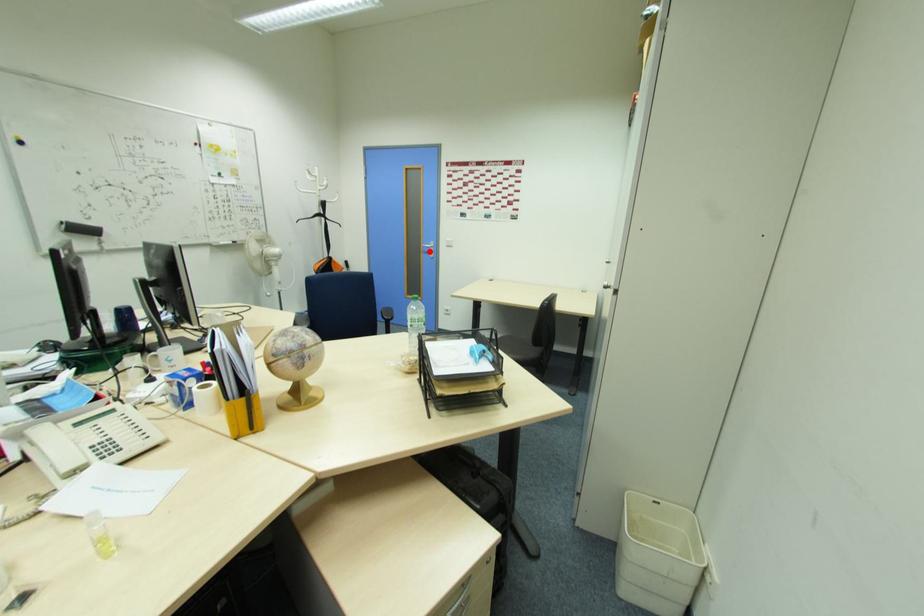
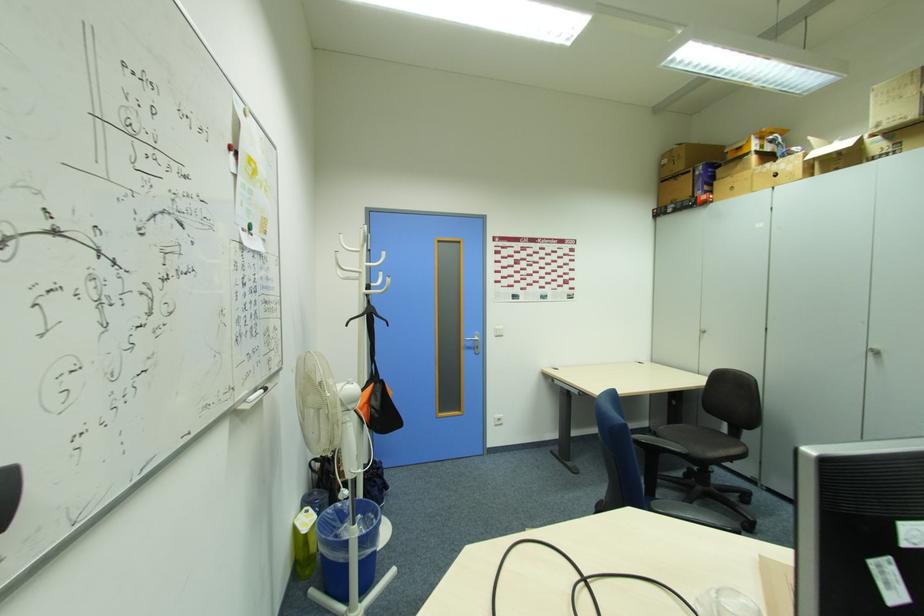
The point at the highlighted location is marked in the first image. Where is the corresponding point in the second image?

(472, 346)